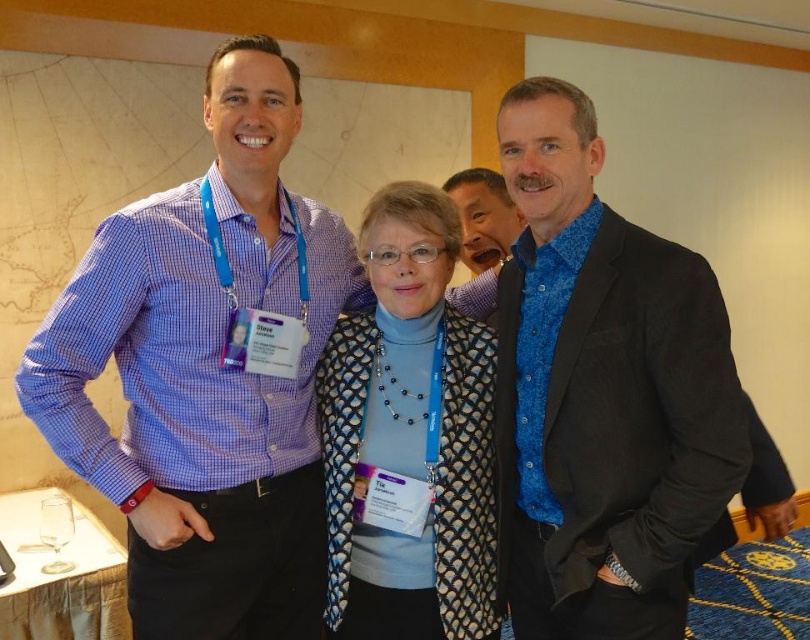
You are standing in the conference room and want to find the matte blue shirt at left. According to the coordinates given, where should you look?

The matte blue shirt at left is located at coordinates point (207, 372).

In the scene shown: You are standing in the conference room and want to move from the point at coordinates point (x=518, y=332) to the point at coordinates point (x=502, y=177). Is the destination point behind or in front of your starting position?

The point at coordinates point (x=502, y=177) is behind the starting point at point (x=518, y=332) because the description states that point (x=518, y=332) is in front of point (x=502, y=177).

Looking at this image, you are organizing a photo shoot and need to ensure that the matte blue shirt at left and the blue textured shirt at center are visible in the frame. Given their sizes, which shirt should you focus on to ensure it doesn

The matte blue shirt at left is larger in size than the blue textured shirt at center, so focusing on the matte blue shirt at left will ensure it is visible in the frame.